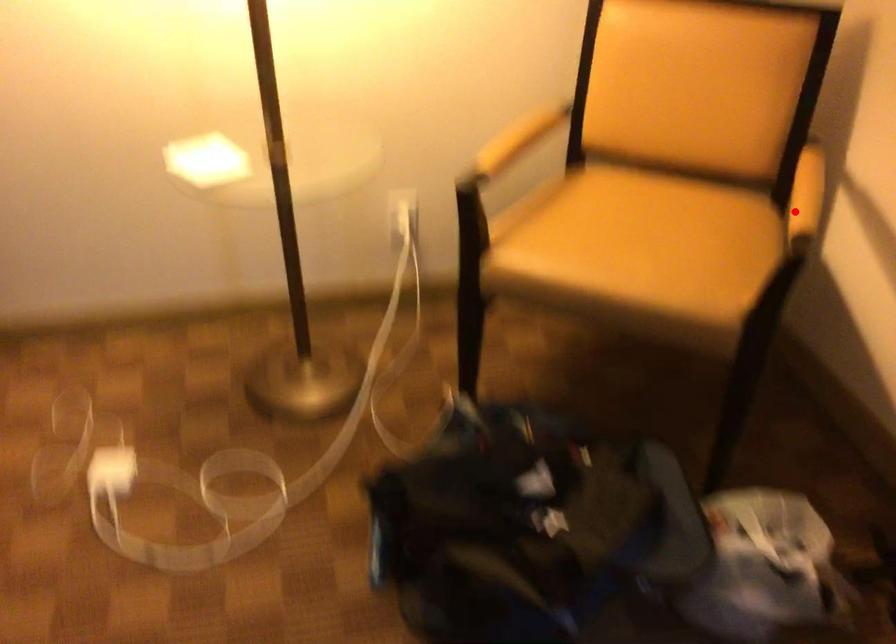
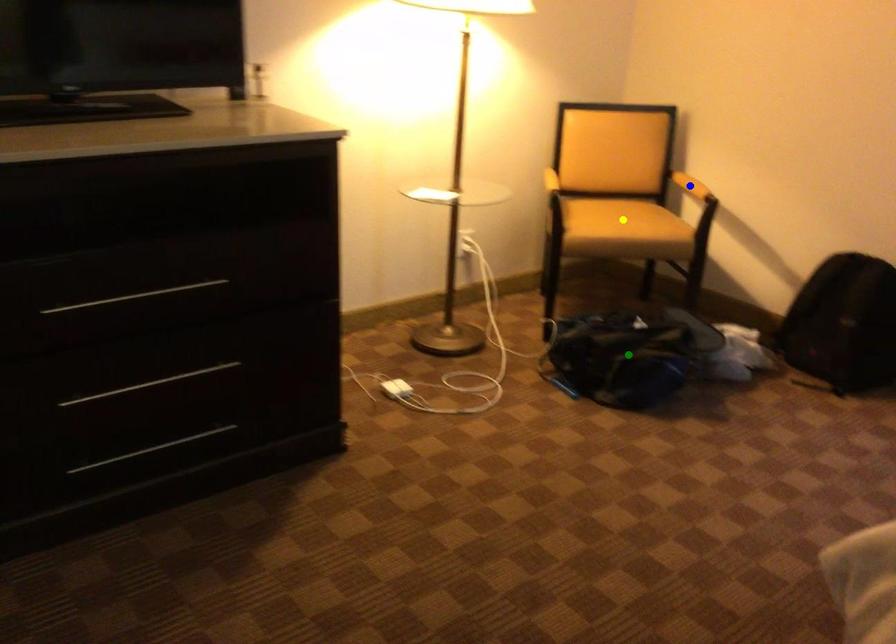
Question: I am providing you with two images of the same scene from different viewpoints. A red point is marked on the first image. You are given multiple points on the second image. Which point in image 2 represents the same 3d spot as the red point in image 1?

Choices:
 (A) yellow point
 (B) blue point
 (C) green point

Answer: (B)